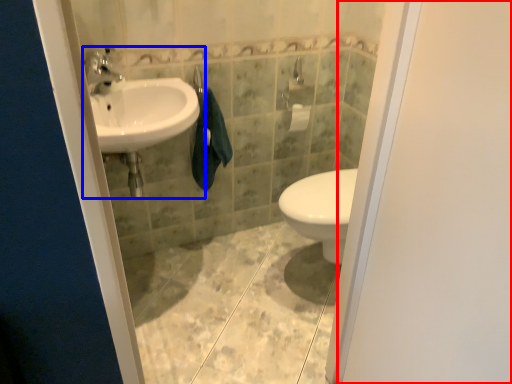
Question: Among these objects, which one is farthest to the camera, screen door (highlighted by a red box) or sink (highlighted by a blue box)?

Choices:
 (A) screen door
 (B) sink

Answer: (B)